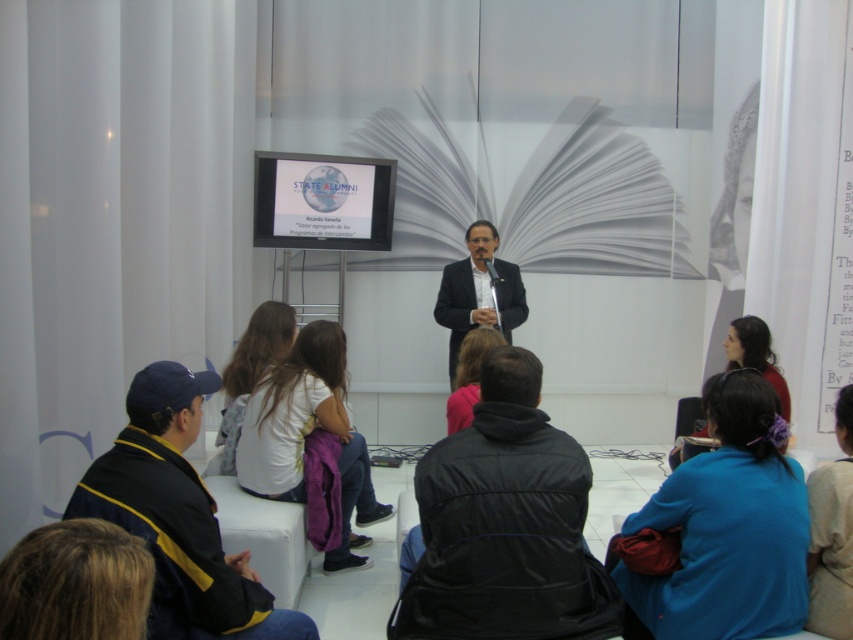
Does graduation gown at lower left appear under white cotton shirt at center?

Incorrect, graduation gown at lower left is not positioned below white cotton shirt at center.

Which is behind, point (172, 472) or point (338, 556)?

Positioned behind is point (338, 556).

This screenshot has height=640, width=853. What do you see at coordinates (178, 516) in the screenshot? I see `graduation gown at lower left` at bounding box center [178, 516].

At what (x,y) coordinates should I click in order to perform the action: click on graduation gown at lower left. Please return your answer as a coordinate pair (x, y). Looking at the image, I should click on (178, 516).

Can you confirm if white matte shirt at center is taller than matte black jacket at lower right?

Correct, white matte shirt at center is much taller as matte black jacket at lower right.

Who is more distant from viewer, (280, 356) or (764, 378)?

The point (280, 356) is more distant.

Locate an element on the screen. white matte shirt at center is located at coordinates (248, 374).

From the picture: Between black nylon jacket at center and graduation gown at lower left, which one has less height?

graduation gown at lower left is shorter.

Does black nylon jacket at center appear on the left side of graduation gown at lower left?

In fact, black nylon jacket at center is to the right of graduation gown at lower left.

Image resolution: width=853 pixels, height=640 pixels. I want to click on black nylon jacket at center, so point(503,524).